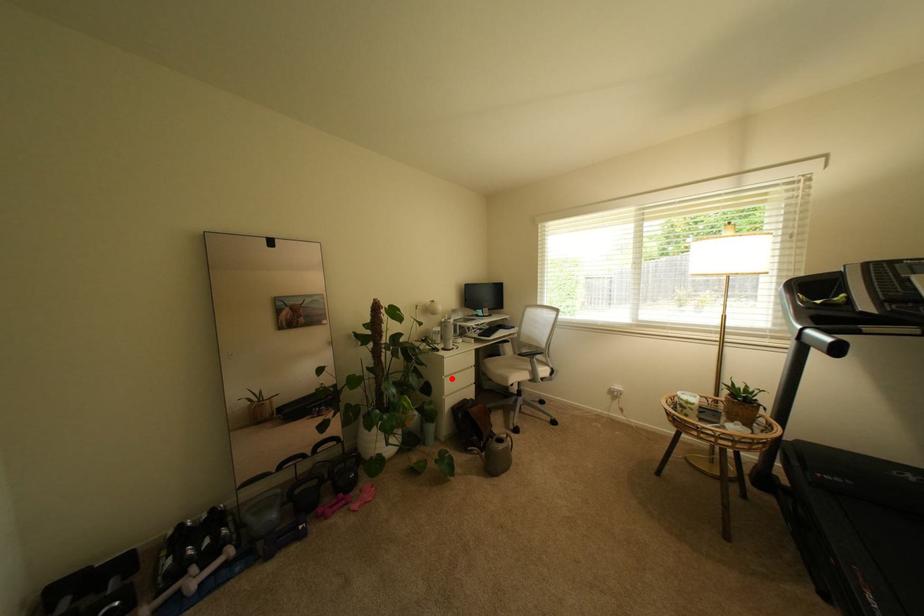
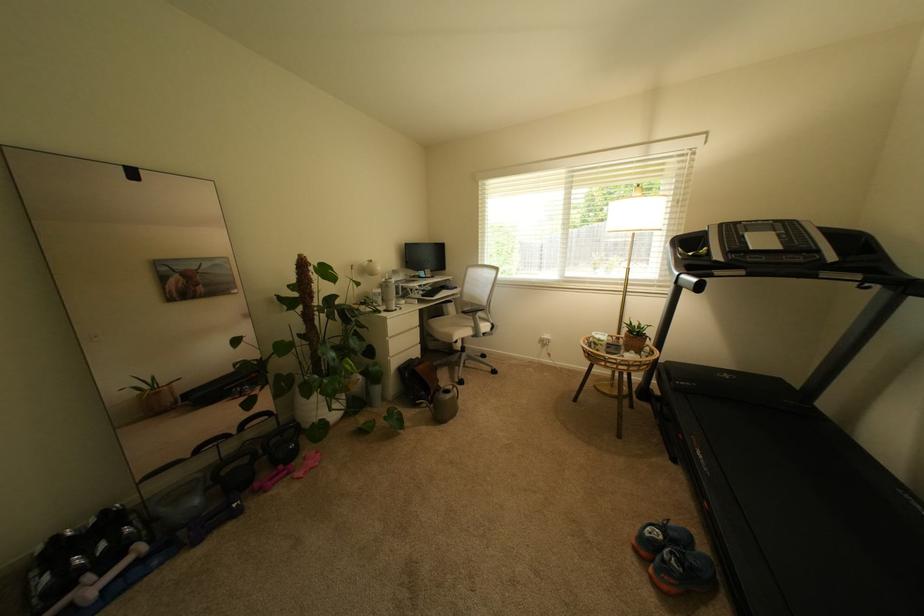
Question: A red point is marked in image1. In image2, is the corresponding 3D point closer to the camera or farther? Reply with the corresponding letter.

Choices:
 (A) The corresponding 3D point is closer.
 (B) The corresponding 3D point is farther.

Answer: (A)